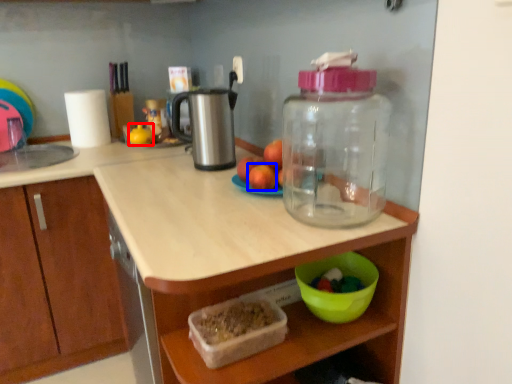
Question: Which object appears closest to the camera in this image, toy (highlighted by a red box) or apple (highlighted by a blue box)?

Choices:
 (A) toy
 (B) apple

Answer: (B)